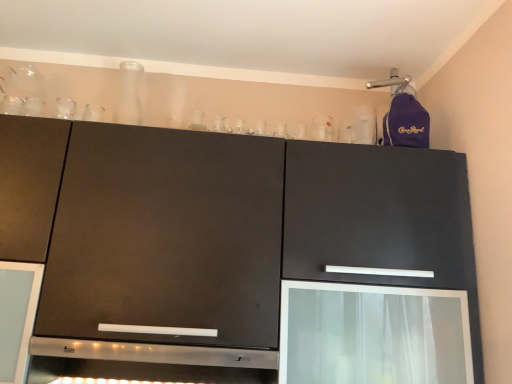
Where is `matte black cabinet at upper center`? Image resolution: width=512 pixels, height=384 pixels. matte black cabinet at upper center is located at coordinates (241, 253).

Identify the location of transparent glass screen door at lower right. The width and height of the screenshot is (512, 384). (373, 334).

The image size is (512, 384). What do you see at coordinates (129, 95) in the screenshot?
I see `transparent glass carafe at upper center` at bounding box center [129, 95].

The image size is (512, 384). I want to click on satin silver exhaust hood at center, so click(153, 353).

The image size is (512, 384). I want to click on glass vase on the left of satin silver exhaust hood at center, so click(x=129, y=95).

Is transparent glass carafe at upper center bigger or smaller than satin silver exhaust hood at center?

In the image, transparent glass carafe at upper center appears to be smaller than satin silver exhaust hood at center.

Are transparent glass carafe at upper center and satin silver exhaust hood at center making contact?

No, transparent glass carafe at upper center is not touching satin silver exhaust hood at center.

From a real-world perspective, which object stands above the other?

From a 3D spatial view, transparent glass carafe at upper center is above.

Considering the positions of objects satin silver exhaust hood at center and transparent glass carafe at upper center in the image provided, who is more to the right, satin silver exhaust hood at center or transparent glass carafe at upper center?

satin silver exhaust hood at center is more to the right.

From the image's perspective, which one is positioned higher, satin silver exhaust hood at center or transparent glass carafe at upper center?

transparent glass carafe at upper center, from the image's perspective.

Can you tell me how much satin silver exhaust hood at center and transparent glass carafe at upper center differ in facing direction?

The angular difference between satin silver exhaust hood at center and transparent glass carafe at upper center is 2.09 degrees.

Is point (85, 348) closer or farther from the camera than point (124, 121)?

Point (85, 348) appears to be closer to the viewer than point (124, 121).

From the image's perspective, is matte black cabinet at upper center on transparent glass screen door at lower right?

Yes.

Would you say matte black cabinet at upper center is outside transparent glass screen door at lower right?

Yes, matte black cabinet at upper center is not within transparent glass screen door at lower right.

Between matte black cabinet at upper center and transparent glass screen door at lower right, which one has larger width?

matte black cabinet at upper center is wider.

Does satin silver exhaust hood at center touch transparent glass screen door at lower right?

No, satin silver exhaust hood at center is not with transparent glass screen door at lower right.

Looking at the image, does satin silver exhaust hood at center seem bigger or smaller compared to transparent glass screen door at lower right?

Considering their sizes, satin silver exhaust hood at center takes up less space than transparent glass screen door at lower right.

Is the position of satin silver exhaust hood at center more distant than that of transparent glass screen door at lower right?

Yes, satin silver exhaust hood at center is behind transparent glass screen door at lower right.

Based on the photo, based on their positions, is satin silver exhaust hood at center located to the left or right of transparent glass screen door at lower right?

satin silver exhaust hood at center is to the left of transparent glass screen door at lower right.

Is transparent glass carafe at upper center further to camera compared to transparent glass screen door at lower right?

Yes, transparent glass carafe at upper center is further from the viewer.

Looking at this image, how many degrees apart are the facing directions of transparent glass carafe at upper center and transparent glass screen door at lower right?

There is a 4.42-degree angle between the facing directions of transparent glass carafe at upper center and transparent glass screen door at lower right.

Could you tell me if transparent glass carafe at upper center is turned towards transparent glass screen door at lower right?

No, transparent glass carafe at upper center does not turn towards transparent glass screen door at lower right.

Is transparent glass screen door at lower right far from transparent glass carafe at upper center?

Indeed, transparent glass screen door at lower right is not near transparent glass carafe at upper center.

Is transparent glass screen door at lower right inside the boundaries of transparent glass carafe at upper center, or outside?

transparent glass screen door at lower right lies outside transparent glass carafe at upper center.

From the picture: In terms of width, does transparent glass screen door at lower right look wider or thinner when compared to transparent glass carafe at upper center?

Considering their sizes, transparent glass screen door at lower right looks broader than transparent glass carafe at upper center.

Is transparent glass screen door at lower right to the left of transparent glass carafe at upper center from the viewer's perspective?

No.

Which is behind, point (125, 74) or point (310, 189)?

The point (125, 74) is farther.

Based on the photo, is transparent glass carafe at upper center positioned far away from matte black cabinet at upper center?

No, there isn't a large distance between transparent glass carafe at upper center and matte black cabinet at upper center.

Which object is further away from the camera taking this photo, transparent glass carafe at upper center or matte black cabinet at upper center?

transparent glass carafe at upper center is further away from the camera.

Consider the image. Is transparent glass carafe at upper center not within matte black cabinet at upper center?

That's correct, transparent glass carafe at upper center is outside of matte black cabinet at upper center.

I want to click on glass vase located behind the satin silver exhaust hood at center, so click(x=129, y=95).

Find the location of a particular element. glass vase that appears above the satin silver exhaust hood at center (from a real-world perspective) is located at coordinates (129, 95).

Based on their spatial positions, is matte black cabinet at upper center or transparent glass carafe at upper center further from transparent glass screen door at lower right?

Based on the image, transparent glass carafe at upper center appears to be further to transparent glass screen door at lower right.

When comparing their distances from transparent glass carafe at upper center, does transparent glass screen door at lower right or matte black cabinet at upper center seem closer?

matte black cabinet at upper center is positioned closer to the anchor transparent glass carafe at upper center.

Which object lies nearer to the anchor point satin silver exhaust hood at center, matte black cabinet at upper center or transparent glass carafe at upper center?

matte black cabinet at upper center is closer to satin silver exhaust hood at center.

Considering their positions, is satin silver exhaust hood at center positioned closer to transparent glass carafe at upper center than transparent glass screen door at lower right?

Based on the image, satin silver exhaust hood at center appears to be nearer to transparent glass carafe at upper center.

When comparing their distances from satin silver exhaust hood at center, does transparent glass screen door at lower right or matte black cabinet at upper center seem closer?

The object closer to satin silver exhaust hood at center is matte black cabinet at upper center.

Which object lies further to the anchor point matte black cabinet at upper center, transparent glass carafe at upper center or satin silver exhaust hood at center?

transparent glass carafe at upper center.

Considering their positions, is matte black cabinet at upper center positioned closer to transparent glass screen door at lower right than satin silver exhaust hood at center?

The object closer to transparent glass screen door at lower right is matte black cabinet at upper center.

Based on their spatial positions, is transparent glass carafe at upper center or transparent glass screen door at lower right further from matte black cabinet at upper center?

The object further to matte black cabinet at upper center is transparent glass carafe at upper center.

Find the location of a particular element. This screenshot has height=384, width=512. screen door between transparent glass carafe at upper center and satin silver exhaust hood at center in the up-down direction is located at coordinates (373, 334).

This screenshot has width=512, height=384. Find the location of `cabinetry between satin silver exhaust hood at center and transparent glass screen door at lower right`. cabinetry between satin silver exhaust hood at center and transparent glass screen door at lower right is located at coordinates (241, 253).

Image resolution: width=512 pixels, height=384 pixels. Find the location of `cabinetry situated between transparent glass carafe at upper center and transparent glass screen door at lower right from left to right`. cabinetry situated between transparent glass carafe at upper center and transparent glass screen door at lower right from left to right is located at coordinates (241, 253).

Identify the location of cabinetry between transparent glass carafe at upper center and satin silver exhaust hood at center in the up-down direction. (241, 253).